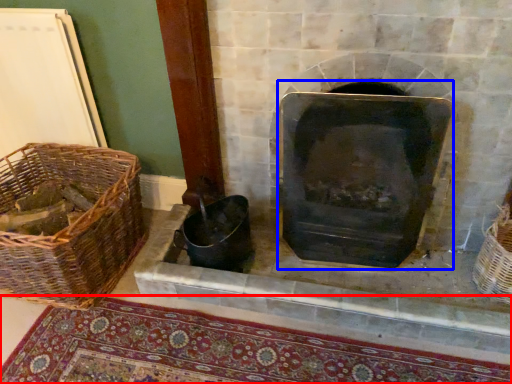
Question: Which object is closer to the camera taking this photo, mat (highlighted by a red box) or wood burning stove (highlighted by a blue box)?

Choices:
 (A) mat
 (B) wood burning stove

Answer: (A)